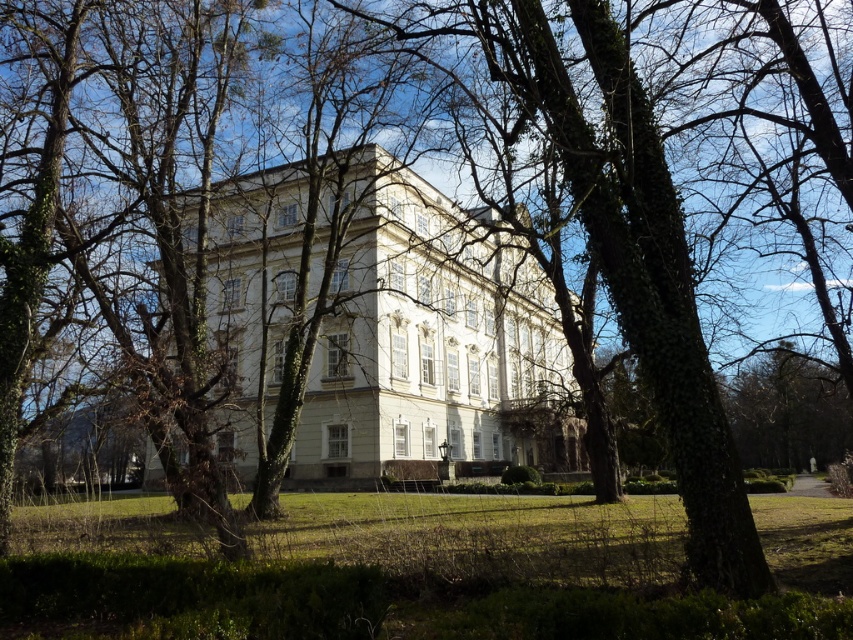
Looking at this image, is green grass at lower center further to camera compared to white glossy mansion at center?

No, green grass at lower center is in front of white glossy mansion at center.

The width and height of the screenshot is (853, 640). I want to click on green grass at lower center, so 419,570.